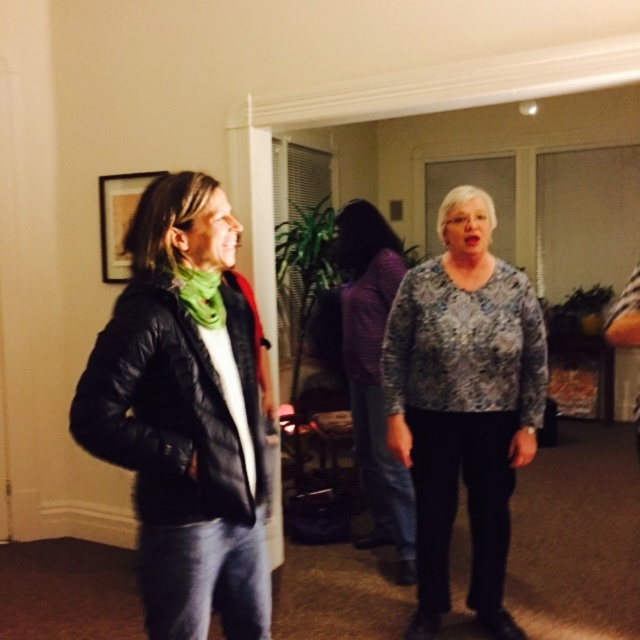
Is black quilted jacket at left shorter than printed fabric blouse at center?

Correct, black quilted jacket at left is not as tall as printed fabric blouse at center.

Who is more distant from viewer, (x=118, y=454) or (x=467, y=268)?

The point (x=467, y=268) is behind.

You are a GUI agent. You are given a task and a screenshot of the screen. Output one action in this format:
    pyautogui.click(x=<x>, y=<y>)
    Task: Click on the black quilted jacket at left
    This screenshot has height=640, width=640.
    Given the screenshot: What is the action you would take?
    pyautogui.click(x=186, y=413)